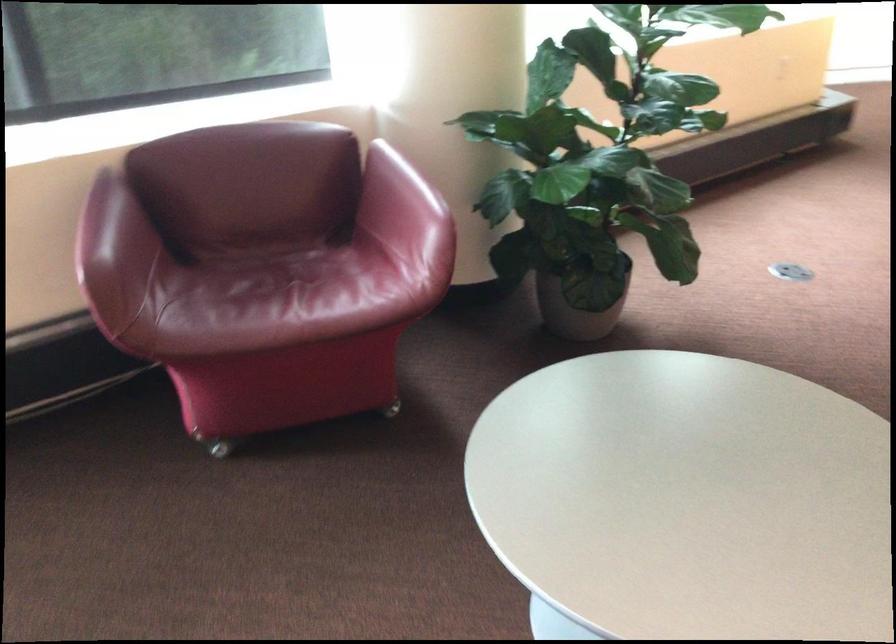
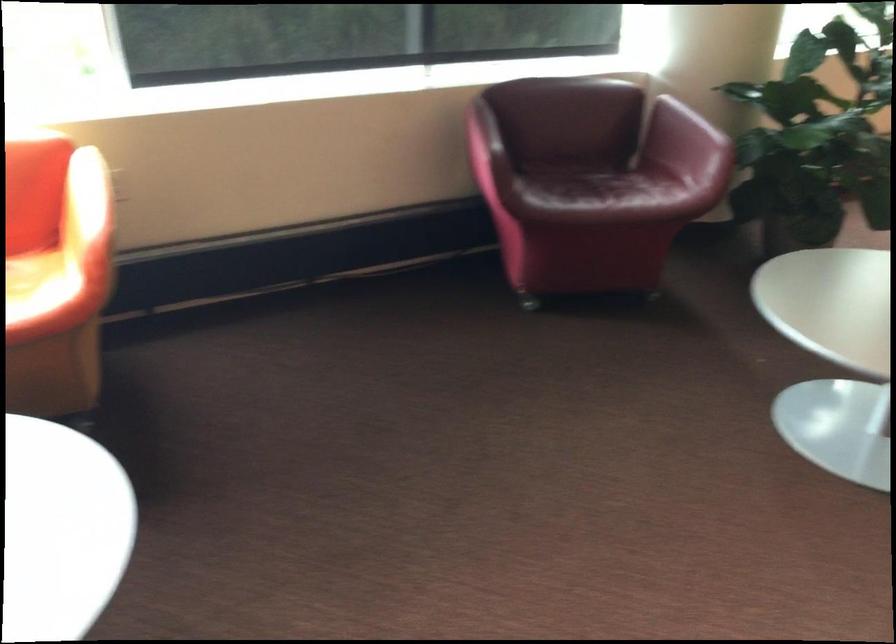
The point at (308, 303) is marked in the first image. Where is the corresponding point in the second image?

(608, 194)